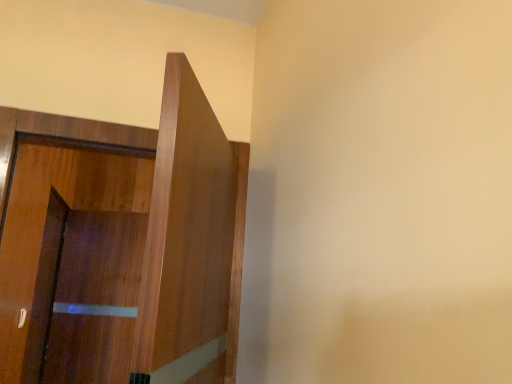
Question: Can you confirm if wooden door at left is wider than brown wood screen door at left?

Choices:
 (A) no
 (B) yes

Answer: (B)

Question: Is wooden door at left oriented towards brown wood screen door at left?

Choices:
 (A) no
 (B) yes

Answer: (A)

Question: Is wooden door at left surrounding brown wood screen door at left?

Choices:
 (A) yes
 (B) no

Answer: (B)

Question: From a real-world perspective, is wooden door at left under brown wood screen door at left?

Choices:
 (A) yes
 (B) no

Answer: (B)

Question: Is wooden door at left taller than brown wood screen door at left?

Choices:
 (A) no
 (B) yes

Answer: (A)

Question: Would you say wooden door at left is outside brown wood screen door at left?

Choices:
 (A) yes
 (B) no

Answer: (A)

Question: Could wooden door at left be considered to be inside brown wood screen door at left?

Choices:
 (A) yes
 (B) no

Answer: (B)

Question: Can you confirm if brown wood screen door at left is shorter than wooden door at left?

Choices:
 (A) yes
 (B) no

Answer: (B)

Question: Can you confirm if brown wood screen door at left is bigger than wooden door at left?

Choices:
 (A) yes
 (B) no

Answer: (B)

Question: From a real-world perspective, is brown wood screen door at left positioned under wooden door at left based on gravity?

Choices:
 (A) yes
 (B) no

Answer: (A)

Question: Is the depth of brown wood screen door at left greater than that of wooden door at left?

Choices:
 (A) yes
 (B) no

Answer: (A)

Question: From the image's perspective, is brown wood screen door at left located beneath wooden door at left?

Choices:
 (A) no
 (B) yes

Answer: (B)

Question: In terms of height, does brown wood screen door at left look taller or shorter compared to wooden door at left?

Choices:
 (A) tall
 (B) short

Answer: (A)